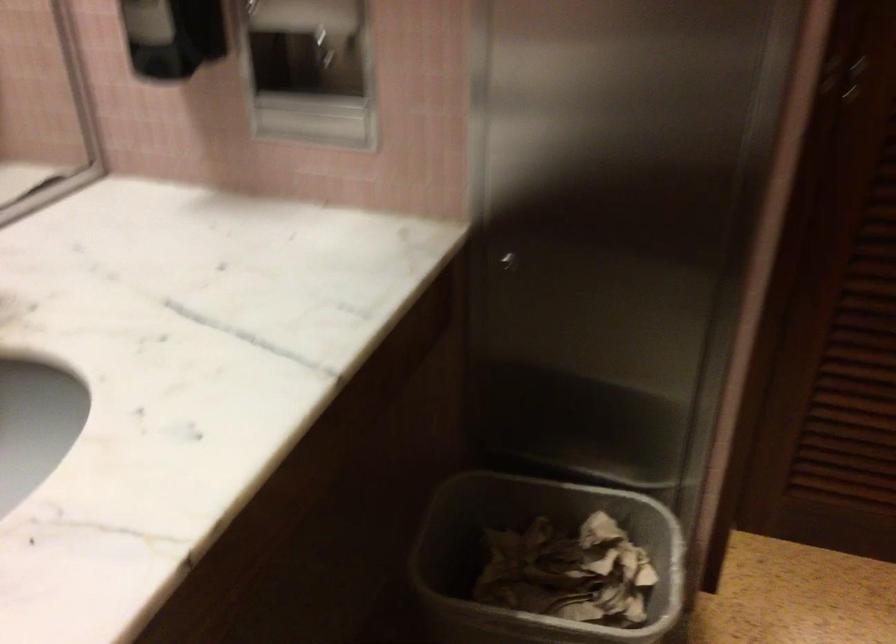
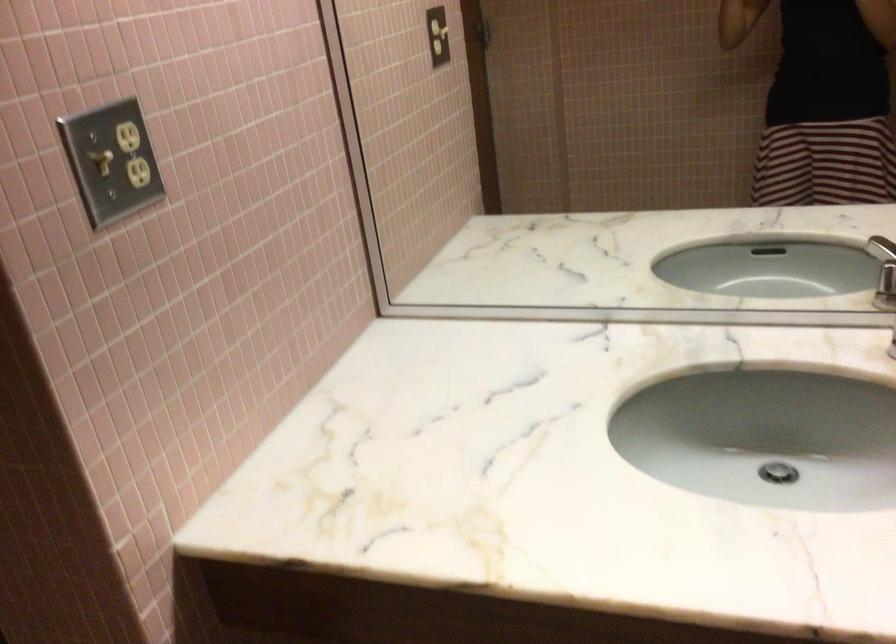
Based on the continuous images, in which direction is the camera rotating?

The camera's rotation is toward left-down.